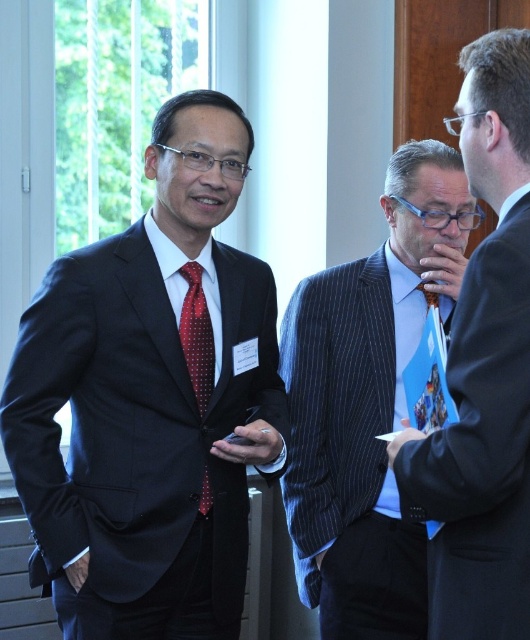
Question: Is matte black suit at left smaller than blue pinstripe suit at center?

Choices:
 (A) yes
 (B) no

Answer: (B)

Question: Can you confirm if matte black suit at left is bigger than blue silk tie at center?

Choices:
 (A) no
 (B) yes

Answer: (B)

Question: Among these objects, which one is farthest from the camera?

Choices:
 (A) red dotted silk tie at center
 (B) blue silk tie at center
 (C) blue pinstripe suit at center
 (D) matte black suit at left

Answer: (C)

Question: Is blue pinstripe suit at center positioned behind blue silk tie at center?

Choices:
 (A) no
 (B) yes

Answer: (B)

Question: Which point is farther to the camera?

Choices:
 (A) blue pinstripe suit at center
 (B) blue silk tie at center
 (C) matte black suit at left
 (D) red dotted silk tie at center

Answer: (A)

Question: Which point is closer to the camera?

Choices:
 (A) blue pinstripe suit at center
 (B) blue silk tie at center
 (C) red dotted silk tie at center

Answer: (B)